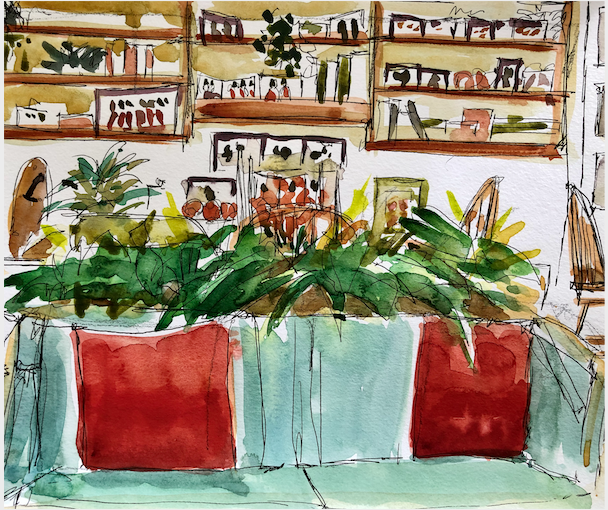
You are a GUI agent. You are given a task and a screenshot of the screen. Output one action in this format:
    pyautogui.click(x=<x>, y=<y>)
    Task: Click on the 3 brown shelves
    The height and width of the screenshot is (510, 608).
    Given the screenshot: What is the action you would take?
    pyautogui.click(x=120, y=100), pyautogui.click(x=240, y=95), pyautogui.click(x=424, y=141)